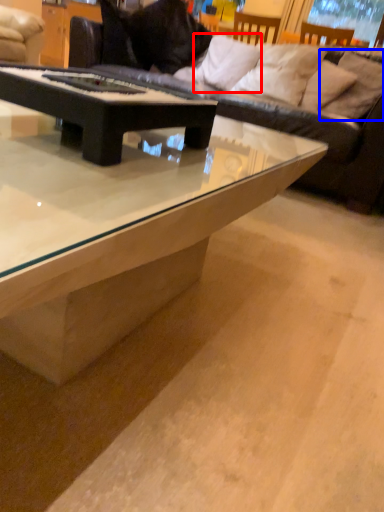
Question: Which object appears farthest to the camera in this image, pillow (highlighted by a red box) or pillow (highlighted by a blue box)?

Choices:
 (A) pillow
 (B) pillow

Answer: (A)